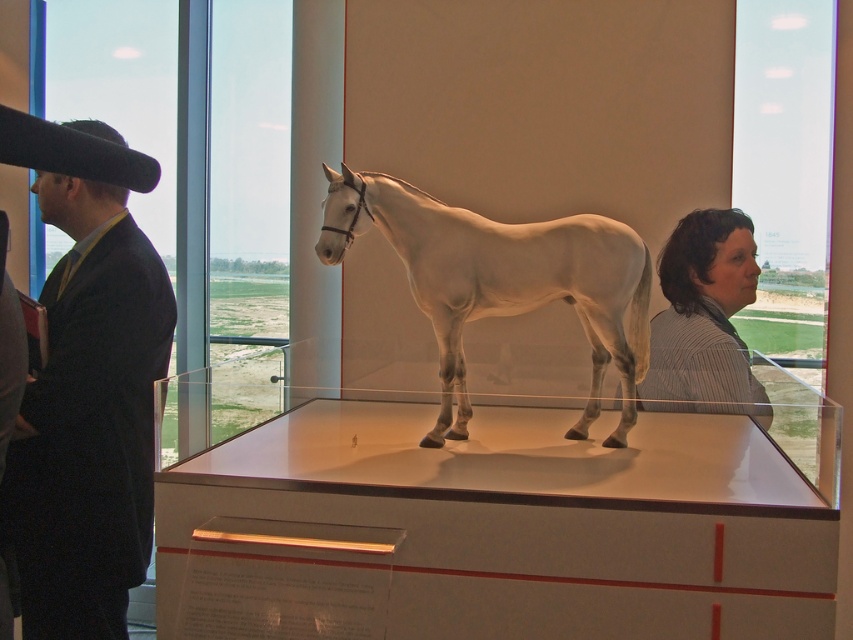
You are a visitor standing in front of the museum exhibit. You notice the black suit at left and the horse model. Which object is closer to the front of the display case?

The black suit at left is closer to the front of the display case because it is located at point (90, 419), which is closer to the front compared to the horse model positioned on the raised platform inside the case.